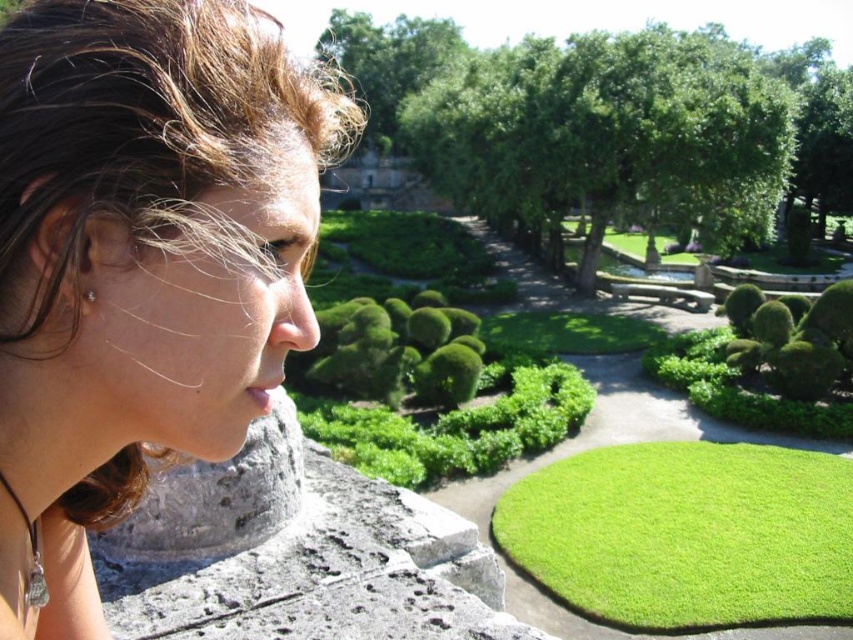
You are standing in the garden looking at the brown hair at upper left and the green leafy hedge at lower right. Which object is positioned higher in the image?

The brown hair at upper left is located above the green leafy hedge at lower right, so it is positioned higher in the image.

You are standing in the garden and want to place a small statue between the green leafy hedge at lower right and the silver metallic earring at left. Is the space between them suitable for placing the statue?

The green leafy hedge at lower right is below the silver metallic earring at left, so the space between them is vertical. Since the statue is small, it might fit if placed horizontally between them, but the vertical distance may be limited. However, the earring is likely worn by a person and not a fixed object in the garden, so placing a statue there isn